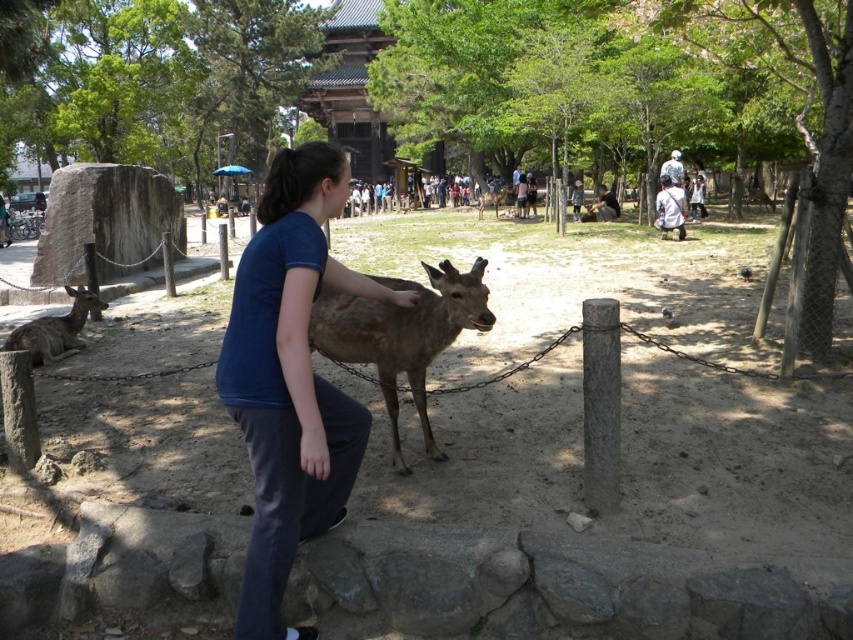
You are a photographer standing at the edge of the scene. You want to capture a photo where the blue cotton shirt at center and the brown fur deer at left are both visible. Based on their positions, which object is closer to the camera?

The blue cotton shirt at center is below the brown fur deer at left, meaning the deer is positioned higher in the frame. Since the shirt is below the deer, the deer is closer to the camera because objects higher up in the image are typically closer to the viewer in such compositions.